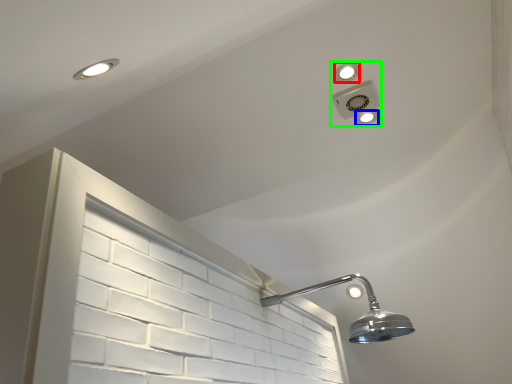
Question: Estimate the real-world distances between objects in this image. Which object is farther from dot (highlighted by a red box), dot (highlighted by a blue box) or fixture (highlighted by a green box)?

Choices:
 (A) dot
 (B) fixture

Answer: (A)